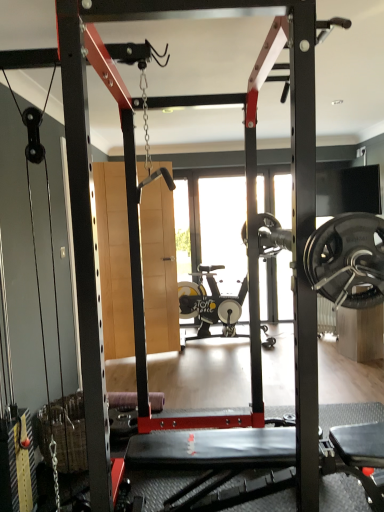
The image size is (384, 512). I want to click on vacant space to the right of wooden at center, so click(187, 360).